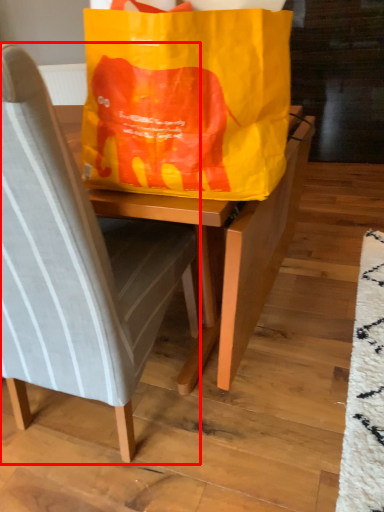
Question: In this image, where is chair (annotated by the red box) located relative to grocery bag?

Choices:
 (A) right
 (B) left

Answer: (B)